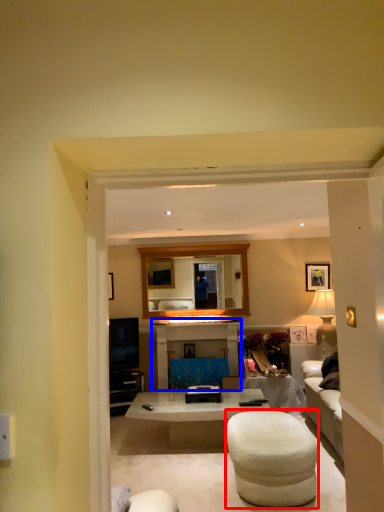
Question: Which point is closer to the camera, bar stool (highlighted by a red box) or entertainment center (highlighted by a blue box)?

Choices:
 (A) bar stool
 (B) entertainment center

Answer: (A)